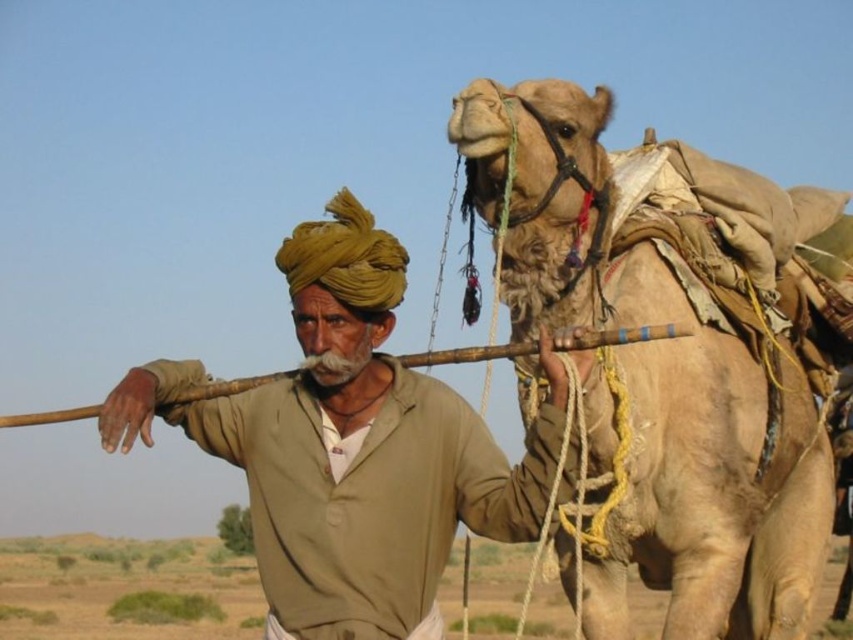
Between fuzzy beige camel at right and khaki cotton shirt at center, which one appears on the right side from the viewer's perspective?

fuzzy beige camel at right

Which is in front, point (782, 280) or point (310, 582)?

Point (310, 582) is in front.

Does point (572, 115) come closer to viewer compared to point (311, 451)?

Yes.

Find the location of `fuzzy beige camel at right`. fuzzy beige camel at right is located at coordinates (670, 355).